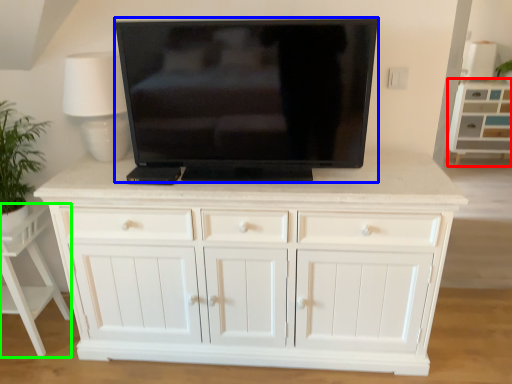
Question: Which is farther away from cabinetry (highlighted by a red box)? television (highlighted by a blue box) or vanity (highlighted by a green box)?

Choices:
 (A) television
 (B) vanity

Answer: (B)